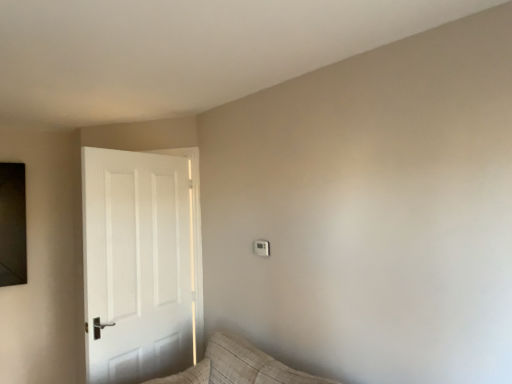
You are a GUI agent. You are given a task and a screenshot of the screen. Output one action in this format:
    pyautogui.click(x=<x>, y=<y>)
    Task: Click on the white plastic light switch at upper center
    The height and width of the screenshot is (384, 512).
    Given the screenshot: What is the action you would take?
    (261, 248)

Describe the element at coordinates (261, 248) in the screenshot. I see `white plastic light switch at upper center` at that location.

Measure the distance between white plastic light switch at upper center and camera.

The depth of white plastic light switch at upper center is 2.41 meters.

In order to face white plastic light switch at upper center, should I rotate leftwards or rightwards?

To align with it, rotate right about 0.811°.

From the picture: What is the approximate height of white plastic light switch at upper center?

white plastic light switch at upper center is 4.41 inches in height.

What do you see at coordinates (141, 264) in the screenshot?
I see `white matte door at left` at bounding box center [141, 264].

Find the location of a particular element. The width and height of the screenshot is (512, 384). white matte door at left is located at coordinates (141, 264).

This screenshot has height=384, width=512. I want to click on white plastic light switch at upper center, so click(x=261, y=248).

Is white matte door at left to the right of white plastic light switch at upper center from the viewer's perspective?

No, white matte door at left is not to the right of white plastic light switch at upper center.

Is the position of white matte door at left less distant than that of white plastic light switch at upper center?

Yes, the depth of white matte door at left is less than that of white plastic light switch at upper center.

Consider the image. Which is closer to the camera, (129, 157) or (266, 247)?

The point (266, 247) is in front.

From the image's perspective, is white matte door at left located beneath white plastic light switch at upper center?

Yes, from the image's perspective, white matte door at left is beneath white plastic light switch at upper center.

From a real-world perspective, is white matte door at left under white plastic light switch at upper center?

Yes, from a real-world perspective, white matte door at left is under white plastic light switch at upper center.

Is white matte door at left wider or thinner than white plastic light switch at upper center?

white matte door at left is wider than white plastic light switch at upper center.

Who is taller, white matte door at left or white plastic light switch at upper center?

white matte door at left.

Which of these two, white matte door at left or white plastic light switch at upper center, is smaller?

white plastic light switch at upper center is smaller.

Would you say white matte door at left is outside white plastic light switch at upper center?

Yes, white matte door at left is outside of white plastic light switch at upper center.

Is white matte door at left not close to white plastic light switch at upper center?

No, white matte door at left is not far away from white plastic light switch at upper center.

Could you tell me if white matte door at left is facing white plastic light switch at upper center?

No.

How many degrees apart are the facing directions of white matte door at left and white plastic light switch at upper center?

The angle between the facing direction of white matte door at left and the facing direction of white plastic light switch at upper center is 73.1 degrees.

How far apart are white matte door at left and white plastic light switch at upper center?

32.91 inches.

Locate an element on the screen. This screenshot has width=512, height=384. light switch that is on the right side of white matte door at left is located at coordinates (261, 248).

Considering the relative positions of white plastic light switch at upper center and white matte door at left in the image provided, is white plastic light switch at upper center to the right of white matte door at left from the viewer's perspective?

Yes, white plastic light switch at upper center is to the right of white matte door at left.

Does white plastic light switch at upper center come behind white matte door at left?

Yes, it is behind white matte door at left.

Which is closer, (258, 245) or (155, 269)?

The point (258, 245) is closer.

From the image's perspective, which one is positioned lower, white plastic light switch at upper center or white matte door at left?

white matte door at left is shown below in the image.

From a real-world perspective, is white plastic light switch at upper center located higher than white matte door at left?

Yes.

Which object is wider, white plastic light switch at upper center or white matte door at left?

white matte door at left is wider.

Considering the sizes of white plastic light switch at upper center and white matte door at left in the image, is white plastic light switch at upper center taller or shorter than white matte door at left?

Clearly, white plastic light switch at upper center is shorter compared to white matte door at left.

Is white plastic light switch at upper center smaller than white matte door at left?

Yes, white plastic light switch at upper center is smaller than white matte door at left.

Is white plastic light switch at upper center located outside white matte door at left?

Yes, white plastic light switch at upper center is located beyond the bounds of white matte door at left.

Is white plastic light switch at upper center placed right next to white matte door at left?

No, white plastic light switch at upper center is not making contact with white matte door at left.

Does white plastic light switch at upper center turn towards white matte door at left?

No, white plastic light switch at upper center is not facing towards white matte door at left.

Identify the location of door below the white plastic light switch at upper center (from a real-world perspective). (141, 264).

Identify the location of door on the left of white plastic light switch at upper center. The width and height of the screenshot is (512, 384). (141, 264).

The width and height of the screenshot is (512, 384). Find the location of `light switch above the white matte door at left (from a real-world perspective)`. light switch above the white matte door at left (from a real-world perspective) is located at coordinates (261, 248).